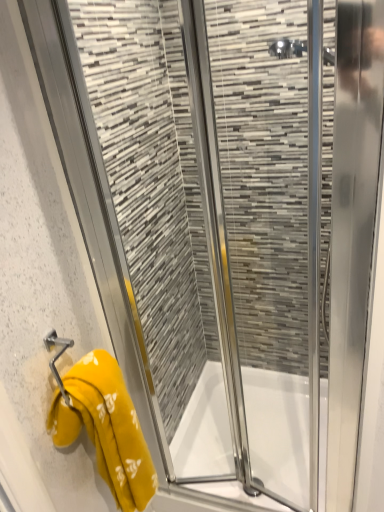
Question: Is white glossy bath at center placed right next to yellow fabric towel at left?

Choices:
 (A) yes
 (B) no

Answer: (B)

Question: From a real-world perspective, is white glossy bath at center located beneath yellow fabric towel at left?

Choices:
 (A) no
 (B) yes

Answer: (B)

Question: From the image's perspective, would you say white glossy bath at center is shown under yellow fabric towel at left?

Choices:
 (A) yes
 (B) no

Answer: (A)

Question: Does white glossy bath at center have a smaller size compared to yellow fabric towel at left?

Choices:
 (A) yes
 (B) no

Answer: (B)

Question: Is white glossy bath at center not inside yellow fabric towel at left?

Choices:
 (A) yes
 (B) no

Answer: (A)

Question: Is white glossy bath at center thinner than yellow fabric towel at left?

Choices:
 (A) yes
 (B) no

Answer: (B)

Question: Is yellow fabric towel at left touching white glossy bath at center?

Choices:
 (A) yes
 (B) no

Answer: (B)

Question: From the image's perspective, is yellow fabric towel at left under white glossy bath at center?

Choices:
 (A) yes
 (B) no

Answer: (B)

Question: Considering the relative sizes of yellow fabric towel at left and white glossy bath at center in the image provided, is yellow fabric towel at left thinner than white glossy bath at center?

Choices:
 (A) no
 (B) yes

Answer: (B)

Question: From the image's perspective, is yellow fabric towel at left located above white glossy bath at center?

Choices:
 (A) no
 (B) yes

Answer: (B)

Question: Is yellow fabric towel at left bigger than white glossy bath at center?

Choices:
 (A) yes
 (B) no

Answer: (B)

Question: Can you confirm if yellow fabric towel at left is shorter than white glossy bath at center?

Choices:
 (A) yes
 (B) no

Answer: (B)

Question: Is yellow fabric towel at left spatially inside white glossy bath at center, or outside of it?

Choices:
 (A) inside
 (B) outside

Answer: (B)